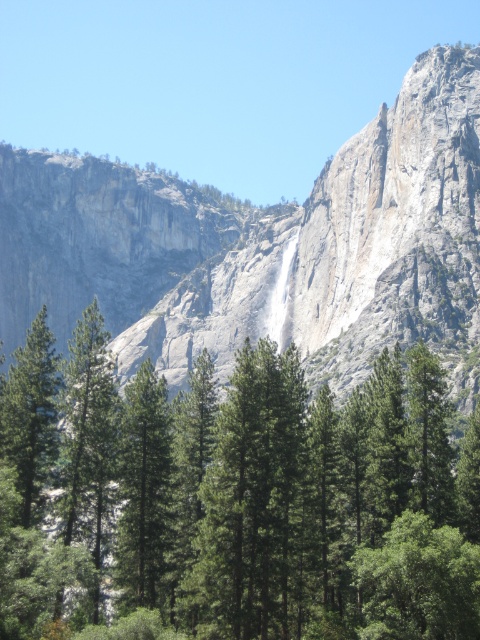
Question: Does green textured pine trees at center have a greater width compared to gray rock face at center?

Choices:
 (A) no
 (B) yes

Answer: (A)

Question: Can you confirm if green textured pine trees at center is positioned to the left of gray rock face at center?

Choices:
 (A) yes
 (B) no

Answer: (B)

Question: Is green textured pine trees at center positioned before gray rock face at center?

Choices:
 (A) no
 (B) yes

Answer: (B)

Question: Among these points, which one is farthest from the camera?

Choices:
 (A) (203, 467)
 (B) (300, 224)

Answer: (B)

Question: Which object appears closest to the camera in this image?

Choices:
 (A) gray rock face at center
 (B) green textured pine trees at center

Answer: (B)